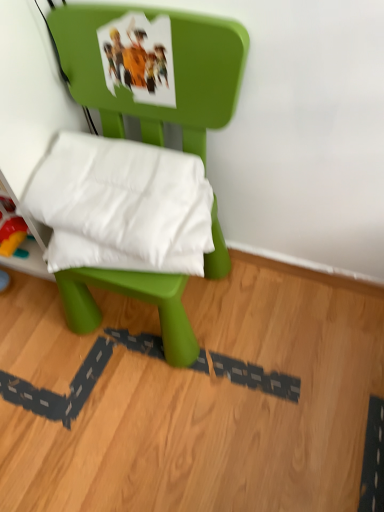
Locate an element on the screen. empty space that is to the right of green plastic chair at center is located at coordinates (282, 321).